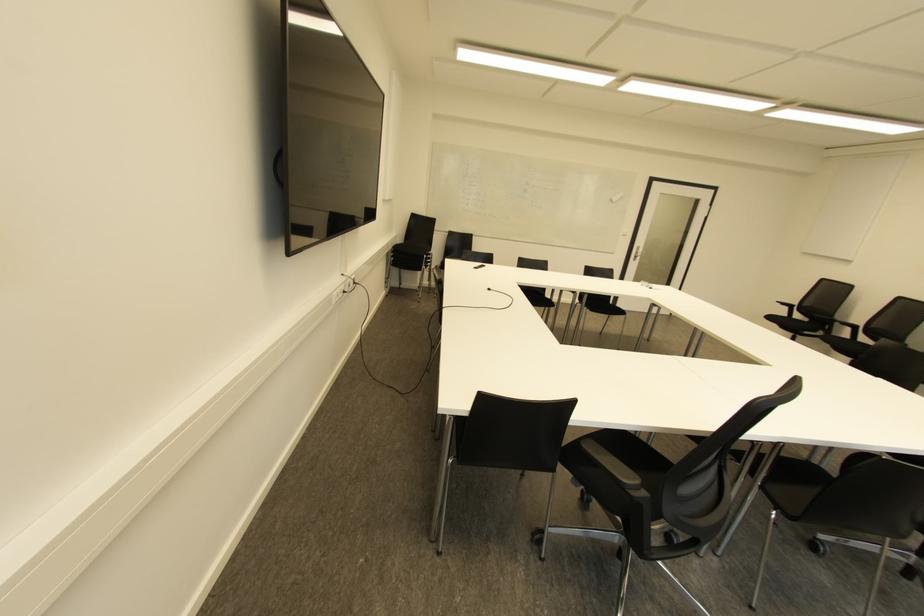
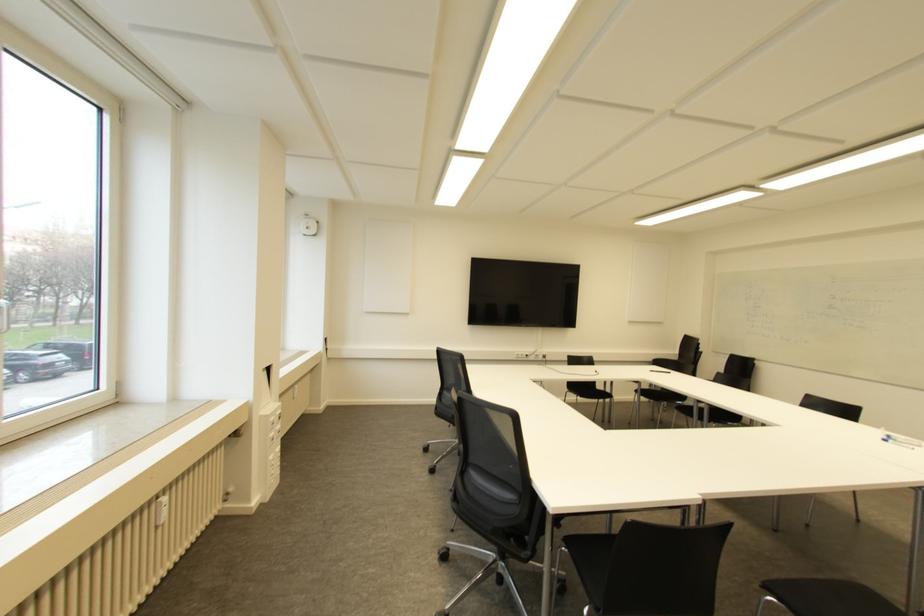
Where in the second image is the point corresponding to pixel 354 282 from the first image?

(543, 355)